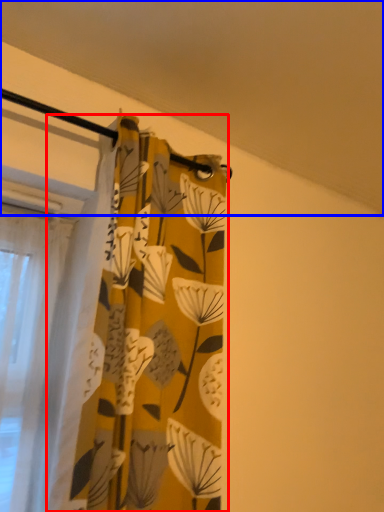
Question: Which object is closer to the camera taking this photo, curtain (highlighted by a red box) or backdrop (highlighted by a blue box)?

Choices:
 (A) curtain
 (B) backdrop

Answer: (B)